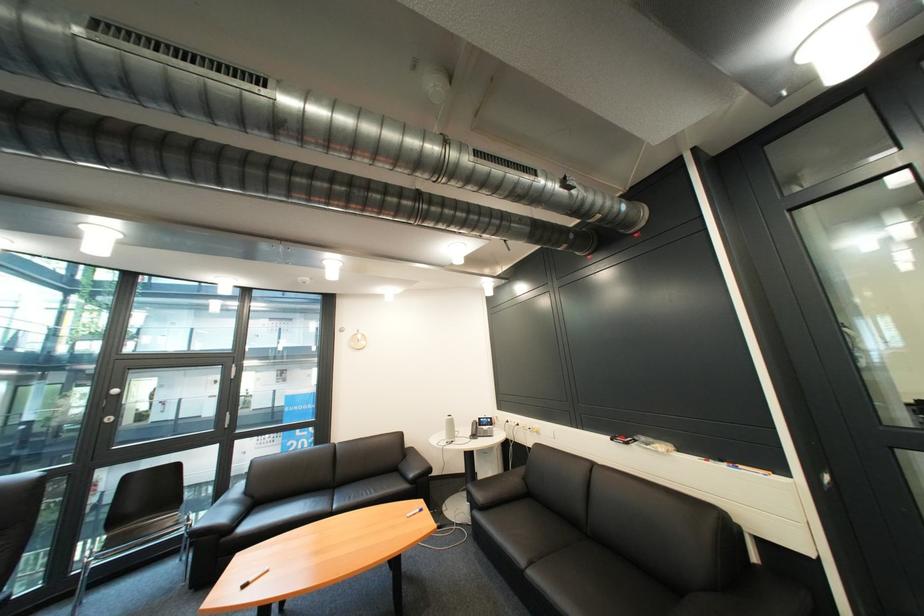
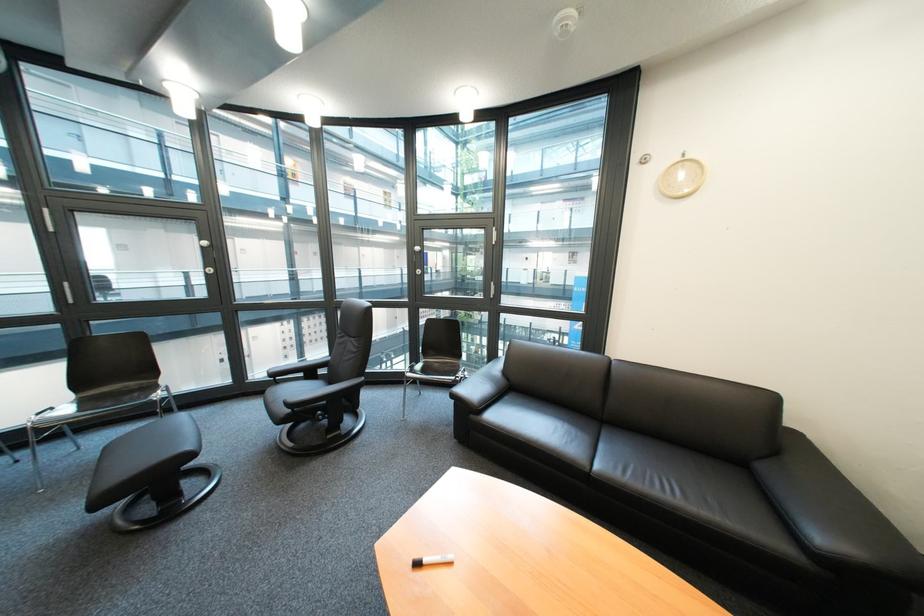
Locate, in the second image, the point that corresponds to pixel 424 477 in the first image.

(833, 540)